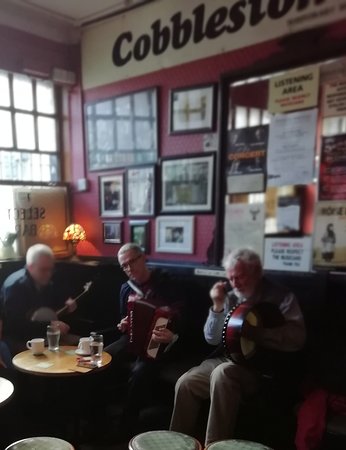
Image resolution: width=346 pixels, height=450 pixels. What are the coordinates of `frames` in the screenshot? It's located at (35, 182), (127, 94), (191, 89), (187, 158), (138, 170), (116, 174), (115, 224), (140, 224), (173, 219), (220, 172).